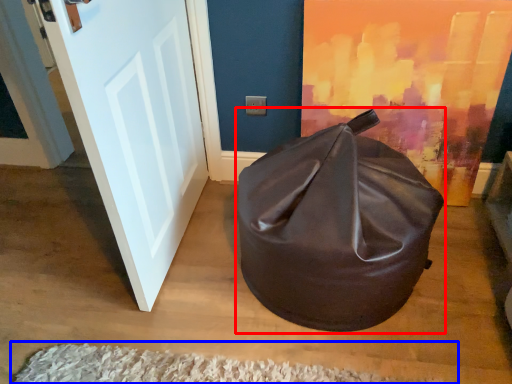
Question: Which object is closer to the camera taking this photo, bean bag chair (highlighted by a red box) or doormat (highlighted by a blue box)?

Choices:
 (A) bean bag chair
 (B) doormat

Answer: (A)